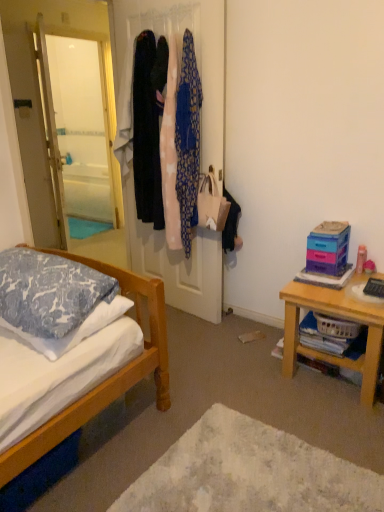
Question: From the image's perspective, is pink fabric at center, positioned as the second clothing in left-to-right order, beneath silky fabric coats at center?

Choices:
 (A) no
 (B) yes

Answer: (A)

Question: Is pink fabric at center, positioned as the second clothing in left-to-right order, not inside silky fabric coats at center?

Choices:
 (A) no
 (B) yes

Answer: (A)

Question: Can you confirm if pink fabric at center, positioned as the second clothing in left-to-right order, is taller than silky fabric coats at center?

Choices:
 (A) yes
 (B) no

Answer: (B)

Question: Is pink fabric at center, positioned as the second clothing in left-to-right order, in front of silky fabric coats at center?

Choices:
 (A) yes
 (B) no

Answer: (B)

Question: Could silky fabric coats at center be considered to be inside pink fabric at center, arranged as the second clothing when viewed from the right?

Choices:
 (A) no
 (B) yes

Answer: (A)

Question: From the image's perspective, is wooden table at right located above or below silky fabric coats at center?

Choices:
 (A) below
 (B) above

Answer: (A)

Question: Does point (375, 309) appear closer or farther from the camera than point (198, 4)?

Choices:
 (A) farther
 (B) closer

Answer: (B)

Question: Is wooden table at right spatially inside silky fabric coats at center, or outside of it?

Choices:
 (A) outside
 (B) inside

Answer: (A)

Question: Is wooden table at right taller or shorter than silky fabric coats at center?

Choices:
 (A) short
 (B) tall

Answer: (A)

Question: Based on their sizes in the image, would you say pink fabric at center, arranged as the second clothing when viewed from the right, is bigger or smaller than pink fabric at center, the first clothing in the right-to-left sequence?

Choices:
 (A) big
 (B) small

Answer: (B)

Question: Is pink fabric at center, positioned as the second clothing in left-to-right order, in front of or behind pink fabric at center, the first clothing in the right-to-left sequence, in the image?

Choices:
 (A) front
 (B) behind

Answer: (B)

Question: From a real-world perspective, is pink fabric at center, arranged as the second clothing when viewed from the right, above or below pink fabric at center, which is the third clothing from left to right?

Choices:
 (A) above
 (B) below

Answer: (A)

Question: Is pink fabric at center, positioned as the second clothing in left-to-right order, inside the boundaries of pink fabric at center, the first clothing in the right-to-left sequence, or outside?

Choices:
 (A) inside
 (B) outside

Answer: (B)

Question: Considering the positions of dark blue fabric dress at center, which is the first clothing from left to right, and white soft rug at lower center in the image, is dark blue fabric dress at center, which is the first clothing from left to right, wider or thinner than white soft rug at lower center?

Choices:
 (A) thin
 (B) wide

Answer: (A)

Question: Considering the positions of dark blue fabric dress at center, positioned as the third clothing in right-to-left order, and white soft rug at lower center in the image, is dark blue fabric dress at center, positioned as the third clothing in right-to-left order, bigger or smaller than white soft rug at lower center?

Choices:
 (A) small
 (B) big

Answer: (A)